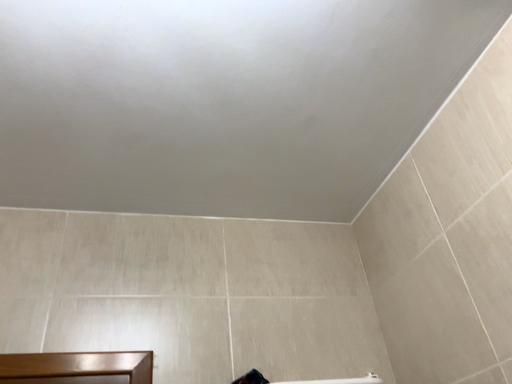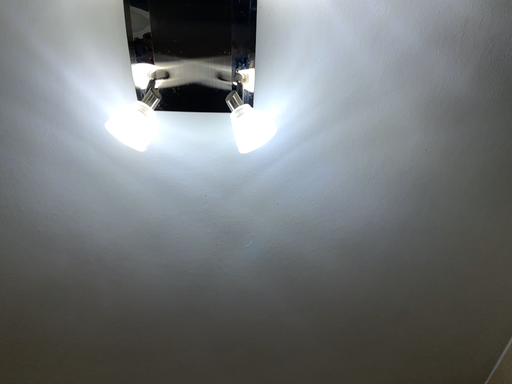
Question: Which way did the camera rotate in the video?

Choices:
 (A) rotated upward
 (B) rotated downward

Answer: (A)